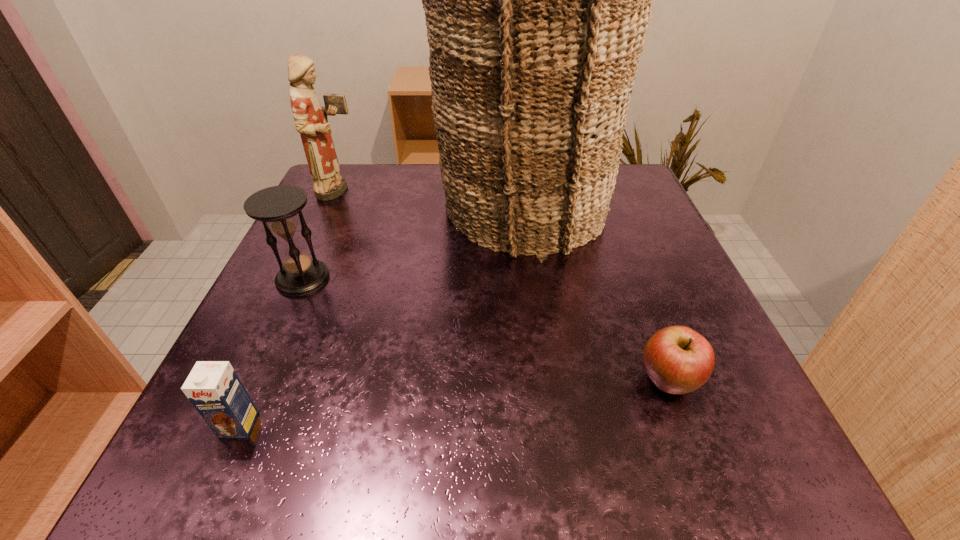
Identify the location of object situated at the far right corner. (537, 0).

I want to click on vacant space at the far edge, so [427, 175].

The width and height of the screenshot is (960, 540). In the image, there is a desktop. Find the location of `vacant space at the near edge`. vacant space at the near edge is located at coordinates (468, 481).

Locate an element on the screen. This screenshot has height=540, width=960. free space at the left edge of the desktop is located at coordinates (324, 337).

In the image, there is a desktop. Find the location of `vacant space at the right edge`. vacant space at the right edge is located at coordinates (612, 310).

Identify the location of free spot at the far left corner of the desktop. Image resolution: width=960 pixels, height=540 pixels. (346, 199).

In order to click on vacant space at the near left corner of the desktop in this screenshot , I will do pyautogui.click(x=261, y=469).

Locate an element on the screen. free space at the far right corner is located at coordinates (654, 219).

Find the location of a particular element. This screenshot has height=540, width=960. vacant area that lies between the nearest object and the apple is located at coordinates (453, 403).

The width and height of the screenshot is (960, 540). I want to click on free space between the basket and the figurine, so click(430, 199).